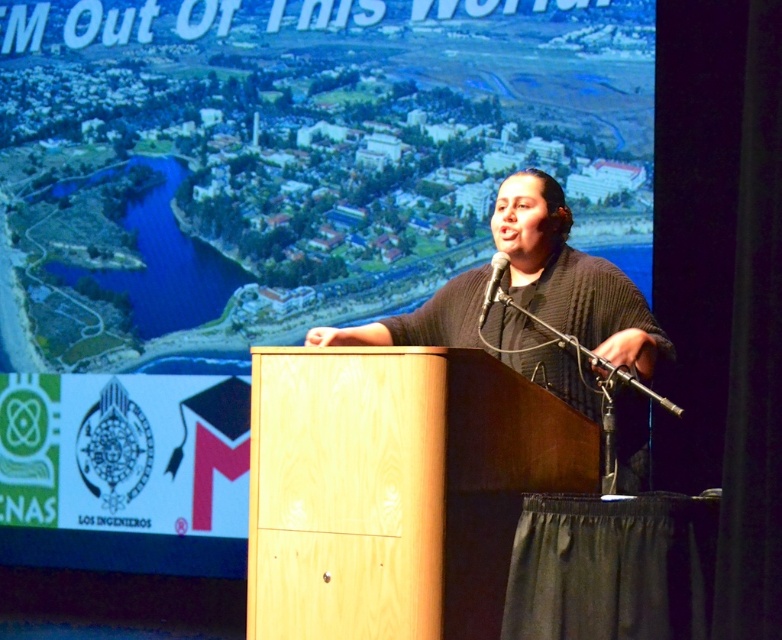
You are attending a presentation and notice two items at the center of the stage. The light wood podium at center and the black knitted sweater at center. Which one takes up more space visually?

The black knitted sweater at center takes up more space visually since it is larger than the light wood podium at center.

You are a photographer trying to capture a closeup of the speaker while ensuring the cityscape on the screen is still visible in the background. Which of the two points, point (273, 596) or point (485, 307), should you focus on to achieve this?

You should focus on point (273, 596) because it is closer to the camera than point (485, 307), allowing the speaker to be in focus while the cityscape remains visible in the background.

You are an event planner setting up a stage for a presentation. You have a light wood podium at center and a black knitted sweater at center. Based on the scene, which object is closer to the audience?

The light wood podium at center is closer to the audience because it is in front of the black knitted sweater at center.